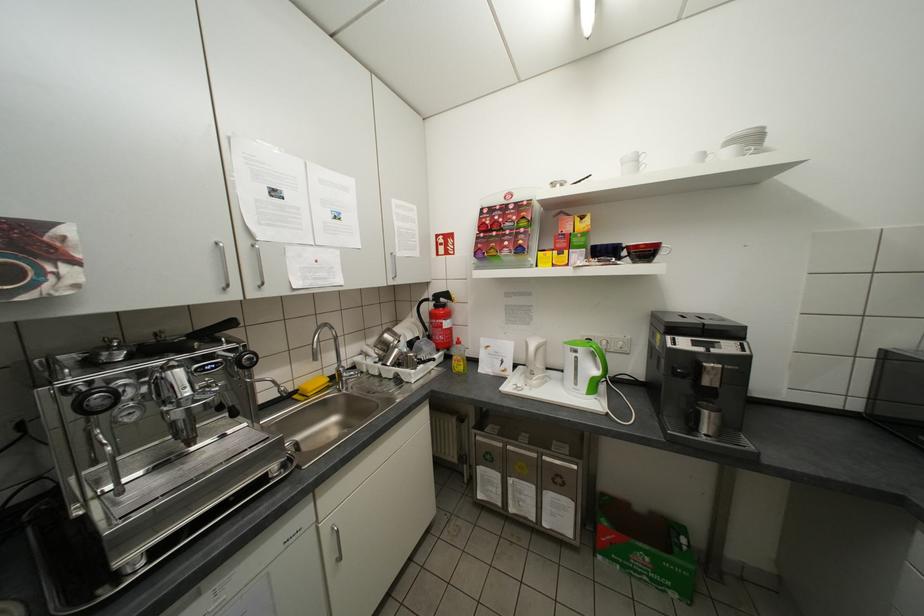
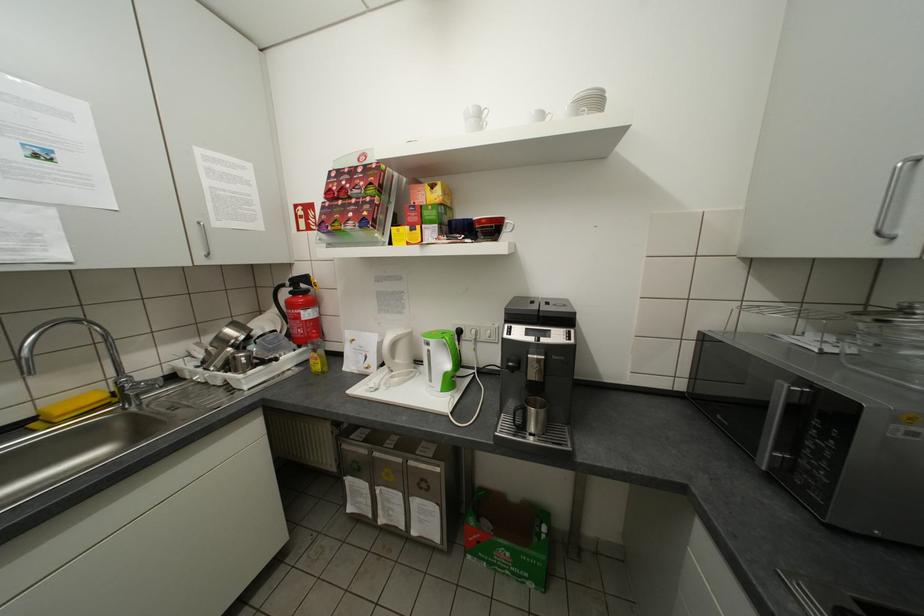
Find the pixel in the second image that matches the point at 463,363 in the first image.

(321, 362)